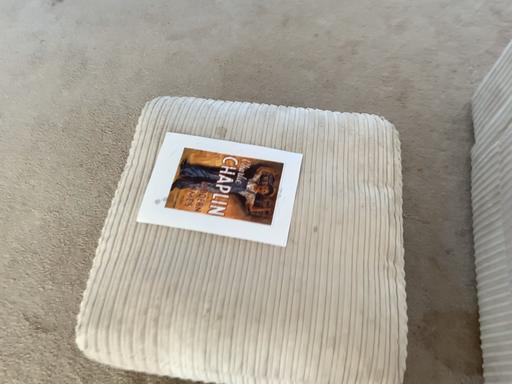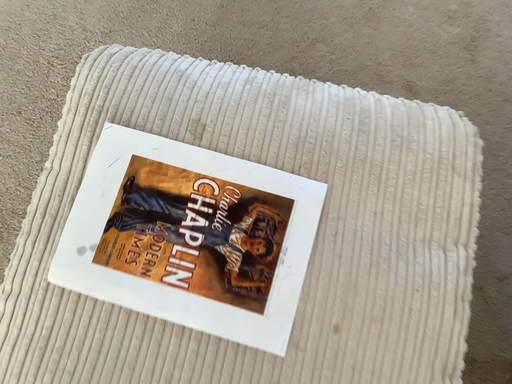
Question: How did the camera likely rotate when shooting the video?

Choices:
 (A) rotated downward
 (B) rotated upward

Answer: (A)